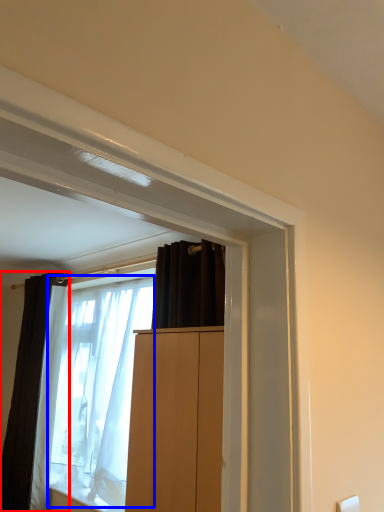
Question: Which object is closer to the camera taking this photo, curtain (highlighted by a red box) or shower curtain (highlighted by a blue box)?

Choices:
 (A) curtain
 (B) shower curtain

Answer: (B)